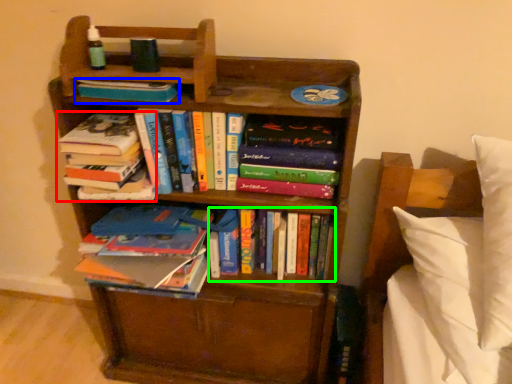
Question: Which is farther away from book (highlighted by a red box)? book (highlighted by a blue box) or book (highlighted by a green box)?

Choices:
 (A) book
 (B) book

Answer: (B)